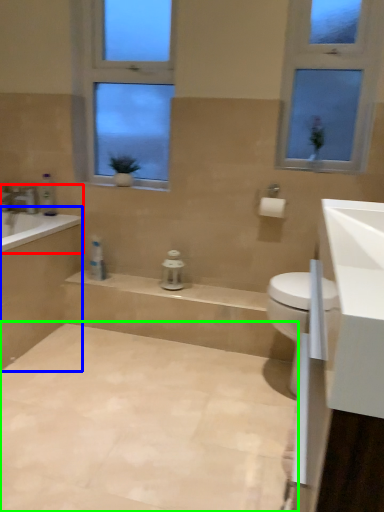
Question: Considering the real-world distances, which object is closest to bathtub (highlighted by a red box)? bath (highlighted by a blue box) or plain (highlighted by a green box).

Choices:
 (A) bath
 (B) plain

Answer: (A)